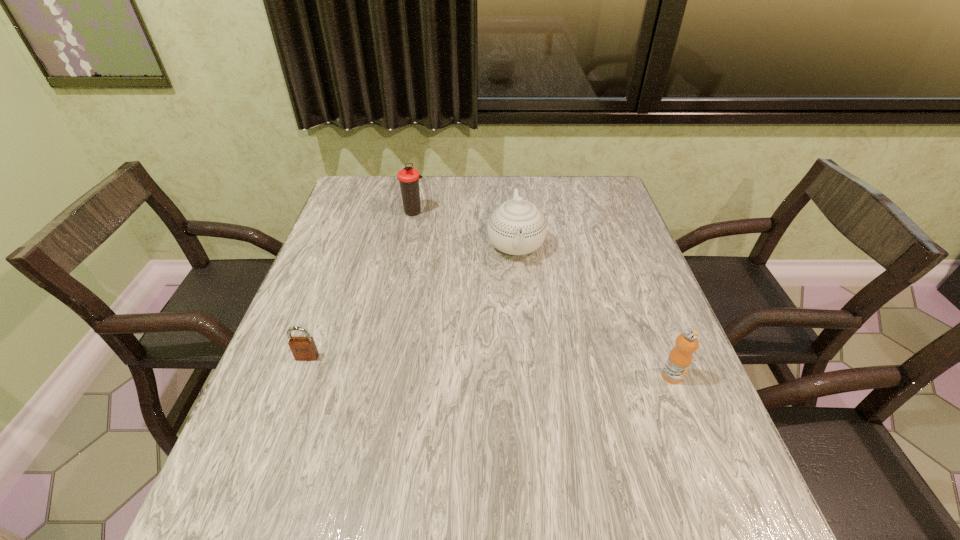
Where is `free space between the nearest object and the third nearest object`? Image resolution: width=960 pixels, height=540 pixels. free space between the nearest object and the third nearest object is located at coordinates (594, 310).

Locate an element on the screen. This screenshot has width=960, height=540. vacant area that lies between the thermos bottle and the second shortest object is located at coordinates (543, 294).

Where is `vacant space that's between the chinaware and the rightmost object`? vacant space that's between the chinaware and the rightmost object is located at coordinates (594, 310).

Find the location of a particular element. This screenshot has width=960, height=540. vacant space that is in between the orange juice and the chinaware is located at coordinates (594, 310).

Locate an element on the screen. unoccupied area between the rightmost object and the third nearest object is located at coordinates [594, 310].

Locate an element on the screen. The height and width of the screenshot is (540, 960). blank region between the nearest object and the padlock is located at coordinates (490, 367).

Where is `unoccupied position between the padlock and the orange juice`? unoccupied position between the padlock and the orange juice is located at coordinates (490, 367).

You are a GUI agent. You are given a task and a screenshot of the screen. Output one action in this format:
    pyautogui.click(x=<x>, y=<y>)
    Task: Click on the vacant space that is in between the padlock and the orange juice
    The width and height of the screenshot is (960, 540).
    Given the screenshot: What is the action you would take?
    pyautogui.click(x=490, y=367)

In order to click on vacant area between the rightmost object and the leftmost object in this screenshot , I will do `click(490, 367)`.

Locate an element on the screen. The width and height of the screenshot is (960, 540). free spot between the farthest object and the padlock is located at coordinates (361, 285).